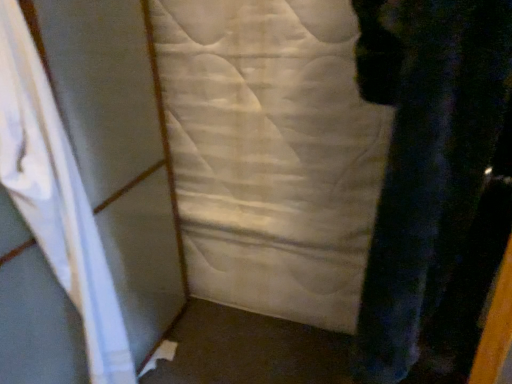
Describe the element at coordinates (271, 153) in the screenshot. I see `white quilted fabric at center` at that location.

What are the coordinates of `white quilted fabric at center` in the screenshot? It's located at (271, 153).

Describe the element at coordinates (56, 198) in the screenshot. I see `white fabric curtain at left` at that location.

Locate an element on the screen. Image resolution: width=512 pixels, height=384 pixels. white fabric curtain at left is located at coordinates (56, 198).

Measure the distance between point (69,272) and camera.

36.85 inches.

Measure the distance between white fabric curtain at left and camera.

A distance of 27.11 inches exists between white fabric curtain at left and camera.

Where is `white quilted fabric at center`? The width and height of the screenshot is (512, 384). white quilted fabric at center is located at coordinates (271, 153).

Between white quilted fabric at center and white fabric curtain at left, which one appears on the left side from the viewer's perspective?

From the viewer's perspective, white fabric curtain at left appears more on the left side.

Relative to white fabric curtain at left, is white quilted fabric at center in front or behind?

In the image, white quilted fabric at center appears behind white fabric curtain at left.

Does point (339, 276) lie behind point (85, 194)?

That is True.

From the image's perspective, is white quilted fabric at center over white fabric curtain at left?

Yes.

From a real-world perspective, which is physically below, white quilted fabric at center or white fabric curtain at left?

From a 3D spatial view, white quilted fabric at center is below.

Can you confirm if white quilted fabric at center is thinner than white fabric curtain at left?

Yes, white quilted fabric at center is thinner than white fabric curtain at left.

Considering the relative sizes of white quilted fabric at center and white fabric curtain at left in the image provided, is white quilted fabric at center taller than white fabric curtain at left?

Incorrect, the height of white quilted fabric at center is not larger of that of white fabric curtain at left.

Considering the relative sizes of white quilted fabric at center and white fabric curtain at left in the image provided, is white quilted fabric at center bigger than white fabric curtain at left?

Yes.

Is white quilted fabric at center inside or outside of white fabric curtain at left?

white quilted fabric at center is located beyond the bounds of white fabric curtain at left.

Based on the photo, is white quilted fabric at center placed right next to white fabric curtain at left?

No, white quilted fabric at center is not next to white fabric curtain at left.

Is white quilted fabric at center positioned with its back to white fabric curtain at left?

white quilted fabric at center does not have its back to white fabric curtain at left.

How many degrees apart are the facing directions of white quilted fabric at center and white fabric curtain at left?

They differ by 76.5 degrees in their facing directions.

The image size is (512, 384). In the image, there is a white fabric curtain at left. In order to click on sheet below it (from a real-world perspective) in this screenshot , I will do `click(271, 153)`.

Visually, is white fabric curtain at left positioned to the left or to the right of white quilted fabric at center?

From the image, it's evident that white fabric curtain at left is to the left of white quilted fabric at center.

Which object is closer to the camera taking this photo, white fabric curtain at left or white quilted fabric at center?

white fabric curtain at left is closer to the camera.

Is point (115, 294) less distant than point (173, 48)?

Yes, point (115, 294) is in front of point (173, 48).

From the image's perspective, does white fabric curtain at left appear higher than white quilted fabric at center?

No.

From a real-world perspective, between white fabric curtain at left and white quilted fabric at center, who is vertically lower?

white quilted fabric at center is physically lower.

Which object is thinner, white fabric curtain at left or white quilted fabric at center?

Thinner between the two is white quilted fabric at center.

Considering the sizes of objects white fabric curtain at left and white quilted fabric at center in the image provided, who is taller, white fabric curtain at left or white quilted fabric at center?

Standing taller between the two is white fabric curtain at left.

Looking at this image, can you confirm if white fabric curtain at left is bigger than white quilted fabric at center?

Actually, white fabric curtain at left might be smaller than white quilted fabric at center.

Is white fabric curtain at left spatially inside white quilted fabric at center, or outside of it?

white fabric curtain at left exists outside the volume of white quilted fabric at center.

Are white fabric curtain at left and white quilted fabric at center far apart?

No, white fabric curtain at left is not far away from white quilted fabric at center.

Is white fabric curtain at left facing away from white quilted fabric at center?

No, white fabric curtain at left's orientation is not away from white quilted fabric at center.

Based on the photo, what's the angular difference between white fabric curtain at left and white quilted fabric at center's facing directions?

The angular difference between white fabric curtain at left and white quilted fabric at center is 76.5 degrees.

In the image, there is a white fabric curtain at left. In order to click on sheet above it (from the image's perspective) in this screenshot , I will do `click(271, 153)`.

Locate an element on the screen. The image size is (512, 384). curtain above the white quilted fabric at center (from a real-world perspective) is located at coordinates (56, 198).

Where is `curtain in front of the white quilted fabric at center`? curtain in front of the white quilted fabric at center is located at coordinates (56, 198).